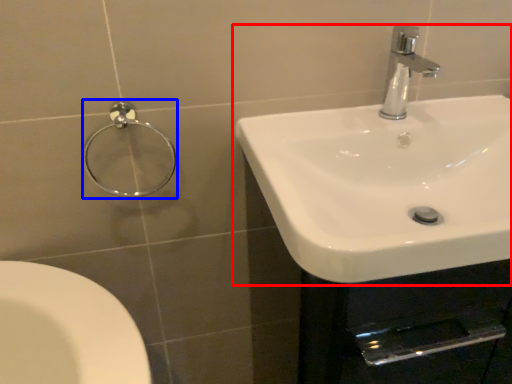
Question: Which object appears farthest to the camera in this image, sink (highlighted by a red box) or shower (highlighted by a blue box)?

Choices:
 (A) sink
 (B) shower

Answer: (B)